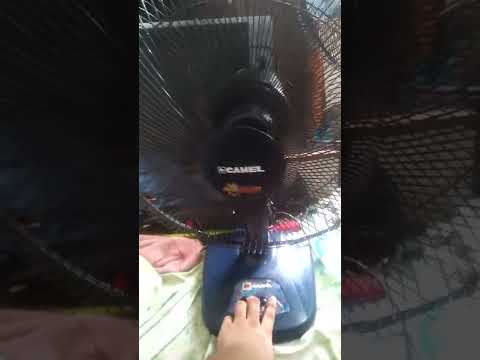
At what (x,y) coordinates should I click in order to perform the action: click on the left hand pressing buttons on fan base, lower center. Please return your answer as a coordinate pair (x, y). This screenshot has width=480, height=360. Looking at the image, I should click on (247, 340).